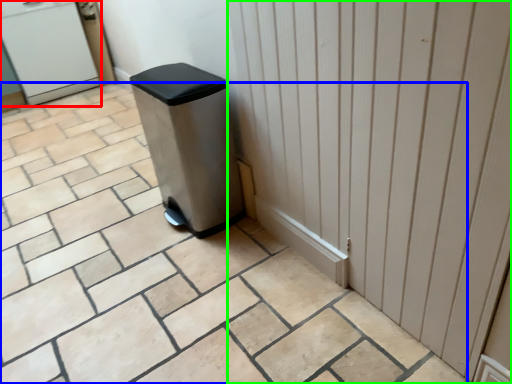
Question: Which is farther away from water cooler (highlighted by a red box)? ceramic tile (highlighted by a blue box) or door (highlighted by a green box)?

Choices:
 (A) ceramic tile
 (B) door

Answer: (B)